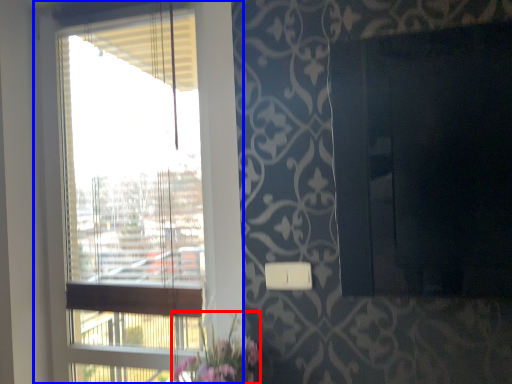
Question: Which object appears closest to the camera in this image, floral arrangement (highlighted by a red box) or window (highlighted by a blue box)?

Choices:
 (A) floral arrangement
 (B) window

Answer: (A)